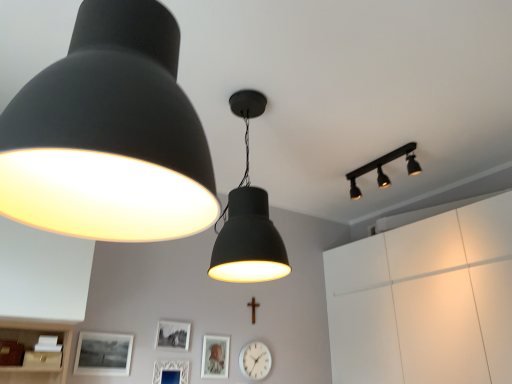
Locate an element on the screen. The image size is (512, 384). matte black picture frame at lower center, which appears as the 2th picture frame when viewed from the left is located at coordinates (173, 335).

This screenshot has width=512, height=384. What do you see at coordinates (425, 300) in the screenshot? I see `white matte cabinet at upper right` at bounding box center [425, 300].

What do you see at coordinates (170, 372) in the screenshot? I see `white textured picture frame at lower center, the 3th picture frame viewed from the left` at bounding box center [170, 372].

You are a GUI agent. You are given a task and a screenshot of the screen. Output one action in this format:
    pyautogui.click(x=<x>, y=<y>)
    Task: Click on the matte black lampshade at center, positioned as the second lamp in back-to-front order
    The image size is (512, 384).
    Given the screenshot: What is the action you would take?
    pyautogui.click(x=248, y=219)

Image resolution: width=512 pixels, height=384 pixels. Find the location of `matte black track light at upper right, which is the 1th lamp from right to left`. matte black track light at upper right, which is the 1th lamp from right to left is located at coordinates (381, 168).

From a real-world perspective, is white matte cabinet at upper right physically located above or below matte black lampshade at upper left, the first lamp positioned from the front?

From a real-world perspective, white matte cabinet at upper right is physically below matte black lampshade at upper left, the first lamp positioned from the front.

Is white matte cabinet at upper right next to matte black lampshade at upper left, which appears as the first lamp when viewed from the left, and touching it?

No.

How many degrees apart are the facing directions of white matte cabinet at upper right and matte black lampshade at upper left, which appears as the first lamp when viewed from the left?

They differ by 88 degrees in their facing directions.

Which is more to the right, white matte cabinet at upper right or matte black lampshade at upper left, the 3th lamp in the back-to-front sequence?

Positioned to the right is white matte cabinet at upper right.

From the image's perspective, does white matte cabinet at upper right appear lower than matte black picture frame at lower left, positioned as the 4th picture frame in right-to-left order?

No.

Is white matte cabinet at upper right smaller than matte black picture frame at lower left, marked as the first picture frame in a left-to-right arrangement?

Incorrect, white matte cabinet at upper right is not smaller in size than matte black picture frame at lower left, marked as the first picture frame in a left-to-right arrangement.

Is white matte cabinet at upper right at the left side of matte black picture frame at lower left, marked as the first picture frame in a left-to-right arrangement?

No, white matte cabinet at upper right is not to the left of matte black picture frame at lower left, marked as the first picture frame in a left-to-right arrangement.

Considering the sizes of white matte cabinet at upper right and matte black picture frame at lower left, marked as the first picture frame in a left-to-right arrangement, in the image, is white matte cabinet at upper right taller or shorter than matte black picture frame at lower left, marked as the first picture frame in a left-to-right arrangement,?

Considering their sizes, white matte cabinet at upper right has more height than matte black picture frame at lower left, marked as the first picture frame in a left-to-right arrangement.

Which of these two, wooden cross at center or white matte cabinet at upper right, stands shorter?

With less height is wooden cross at center.

Is wooden cross at center not inside white matte cabinet at upper right?

wooden cross at center is positioned outside white matte cabinet at upper right.

Which is behind, point (252, 318) or point (422, 286)?

The point (252, 318) is farther.

In terms of width, does wooden cross at center look wider or thinner when compared to white matte cabinet at upper right?

Clearly, wooden cross at center has less width compared to white matte cabinet at upper right.

From a real-world perspective, who is located higher, matte black picture frame at lower left, marked as the first picture frame in a left-to-right arrangement, or white plastic clock at center?

From a 3D spatial view, matte black picture frame at lower left, marked as the first picture frame in a left-to-right arrangement, is above.

Is matte black picture frame at lower left, positioned as the 4th picture frame in right-to-left order, located outside white plastic clock at center?

matte black picture frame at lower left, positioned as the 4th picture frame in right-to-left order, is positioned outside white plastic clock at center.

Can you confirm if matte black picture frame at lower left, positioned as the 4th picture frame in right-to-left order, is bigger than white plastic clock at center?

Actually, matte black picture frame at lower left, positioned as the 4th picture frame in right-to-left order, might be smaller than white plastic clock at center.

Which object is wider, matte black picture frame at lower left, positioned as the 4th picture frame in right-to-left order, or white plastic clock at center?

Wider between the two is white plastic clock at center.

Is white plastic clock at center oriented towards matte black track light at upper right, positioned as the 3th lamp in left-to-right order?

No, white plastic clock at center is not oriented towards matte black track light at upper right, positioned as the 3th lamp in left-to-right order.

Who is smaller, white plastic clock at center or matte black track light at upper right, which is counted as the 3th lamp, starting from the front?

With smaller size is white plastic clock at center.

Relative to matte black track light at upper right, positioned as the 3th lamp in left-to-right order, is white plastic clock at center in front or behind?

white plastic clock at center is behind matte black track light at upper right, positioned as the 3th lamp in left-to-right order.

Is matte black lampshade at center, the second lamp when ordered from front to back, taller or shorter than matte black picture frame at lower left, marked as the first picture frame in a left-to-right arrangement?

matte black lampshade at center, the second lamp when ordered from front to back, is taller than matte black picture frame at lower left, marked as the first picture frame in a left-to-right arrangement.

Starting from the matte black lampshade at center, positioned as the second lamp in back-to-front order, which picture frame is the 4th one to the left? Please provide its 2D coordinates.

[(103, 354)]

Between matte black lampshade at center, which is counted as the second lamp, starting from the right, and matte black picture frame at lower left, marked as the first picture frame in a left-to-right arrangement, which one is positioned behind?

matte black picture frame at lower left, marked as the first picture frame in a left-to-right arrangement, is behind.

What are the coordinates of `picture frame that appears on the left of matte black picture frame at lower center, which appears as the 2th picture frame when viewed from the left` in the screenshot? It's located at (103, 354).

From the image's perspective, is matte black picture frame at lower center, which appears as the 2th picture frame when viewed from the left, under matte black picture frame at lower left, marked as the first picture frame in a left-to-right arrangement?

Actually, matte black picture frame at lower center, which appears as the 2th picture frame when viewed from the left, appears above matte black picture frame at lower left, marked as the first picture frame in a left-to-right arrangement, in the image.

Between matte black picture frame at lower center, which appears as the 2th picture frame when viewed from the left, and matte black picture frame at lower left, marked as the first picture frame in a left-to-right arrangement, which one has more height?

matte black picture frame at lower left, marked as the first picture frame in a left-to-right arrangement, is taller.

Looking at this image, which object is more forward, matte black picture frame at lower center, which appears as the 2th picture frame when viewed from the left, or matte black picture frame at lower left, positioned as the 4th picture frame in right-to-left order?

matte black picture frame at lower left, positioned as the 4th picture frame in right-to-left order, is in front.

From a real-world perspective, which lamp is the 1st one above the white matte cabinet at upper right? Please provide its 2D coordinates.

[(109, 135)]

The width and height of the screenshot is (512, 384). In order to click on cabinetry that is above the matte black picture frame at lower left, positioned as the 4th picture frame in right-to-left order (from the image's perspective) in this screenshot , I will do `click(425, 300)`.

Estimate the real-world distances between objects in this image. Which object is further from matte black lampshade at center, which appears as the 2th lamp when viewed from the left, white matte cabinet at upper right or white plastic clock at center?

Among the two, white matte cabinet at upper right is located further to matte black lampshade at center, which appears as the 2th lamp when viewed from the left.

Estimate the real-world distances between objects in this image. Which object is further from matte black lampshade at upper left, which appears as the 3th lamp when viewed from the right, matte silver picture frame at center, which ranks as the 1th picture frame in right-to-left order, or white textured picture frame at lower center, which is the 2th picture frame from right to left?

matte silver picture frame at center, which ranks as the 1th picture frame in right-to-left order, is further to matte black lampshade at upper left, which appears as the 3th lamp when viewed from the right.

From the image, which object appears to be nearer to white textured picture frame at lower center, the 3th picture frame viewed from the left, white matte cabinet at upper right or matte black picture frame at lower left, marked as the first picture frame in a left-to-right arrangement?

matte black picture frame at lower left, marked as the first picture frame in a left-to-right arrangement.

Estimate the real-world distances between objects in this image. Which object is closer to matte black track light at upper right, which is counted as the 3th lamp, starting from the front, matte black picture frame at lower center, arranged as the third picture frame when viewed from the right, or matte black lampshade at center, positioned as the second lamp in back-to-front order?

matte black lampshade at center, positioned as the second lamp in back-to-front order, is closer to matte black track light at upper right, which is counted as the 3th lamp, starting from the front.

From the image, which object appears to be nearer to white plastic clock at center, matte black lampshade at center, which is counted as the second lamp, starting from the right, or matte black picture frame at lower center, which appears as the 2th picture frame when viewed from the left?

matte black picture frame at lower center, which appears as the 2th picture frame when viewed from the left, is closer to white plastic clock at center.

Consider the image. Looking at the image, which one is located closer to white plastic clock at center, white textured picture frame at lower center, which is the 2th picture frame from right to left, or matte black lampshade at upper left, which appears as the first lamp when viewed from the left?

white textured picture frame at lower center, which is the 2th picture frame from right to left, is positioned closer to the anchor white plastic clock at center.

Based on the photo, looking at the image, which one is located closer to matte silver picture frame at center, which appears as the fourth picture frame when viewed from the left, white plastic clock at center or matte black lampshade at center, which appears as the 2th lamp when viewed from the left?

white plastic clock at center is positioned closer to the anchor matte silver picture frame at center, which appears as the fourth picture frame when viewed from the left.

From the image, which object appears to be farther from white textured picture frame at lower center, which is the 2th picture frame from right to left, matte black lampshade at upper left, which appears as the first lamp when viewed from the left, or matte silver picture frame at center, which ranks as the 1th picture frame in right-to-left order?

matte black lampshade at upper left, which appears as the first lamp when viewed from the left, is further to white textured picture frame at lower center, which is the 2th picture frame from right to left.

The height and width of the screenshot is (384, 512). In order to click on cabinetry between matte black lampshade at upper left, the 3th lamp in the back-to-front sequence, and white plastic clock at center from front to back in this screenshot , I will do `click(425, 300)`.

Locate an element on the screen. crucifix situated between matte black picture frame at lower left, positioned as the 4th picture frame in right-to-left order, and white matte cabinet at upper right from left to right is located at coordinates (253, 308).

Where is `picture frame situated between white textured picture frame at lower center, which is the 2th picture frame from right to left, and white matte cabinet at upper right from left to right`? Image resolution: width=512 pixels, height=384 pixels. picture frame situated between white textured picture frame at lower center, which is the 2th picture frame from right to left, and white matte cabinet at upper right from left to right is located at coordinates (215, 356).

At what (x,y) coordinates should I click in order to perform the action: click on picture frame between matte black lampshade at center, which is counted as the second lamp, starting from the right, and matte black picture frame at lower left, positioned as the 4th picture frame in right-to-left order, in the vertical direction. Please return your answer as a coordinate pair (x, y). Looking at the image, I should click on coord(173,335).